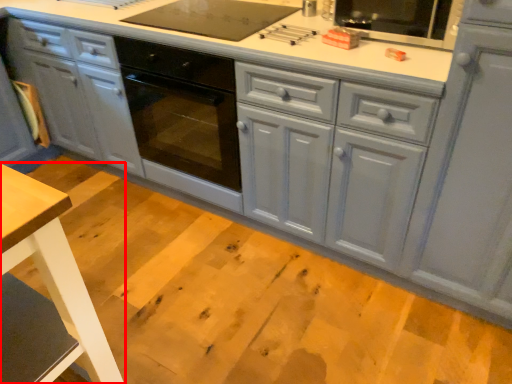
Question: From the image's perspective, considering the relative positions of table (annotated by the red box) and cabinetry in the image provided, where is table (annotated by the red box) located with respect to the staircase?

Choices:
 (A) above
 (B) below

Answer: (B)